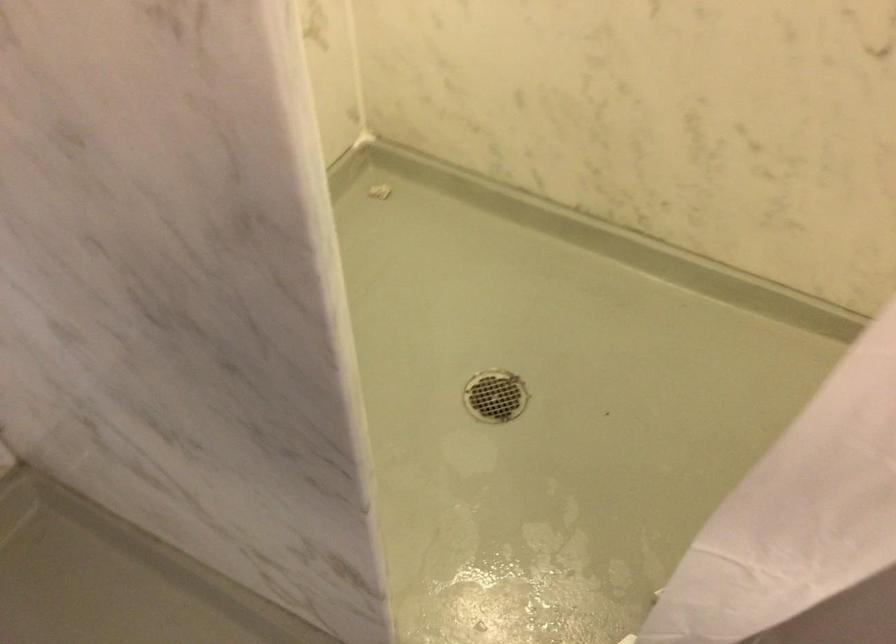
Image resolution: width=896 pixels, height=644 pixels. What do you see at coordinates (495, 395) in the screenshot? I see `a round drain cover` at bounding box center [495, 395].